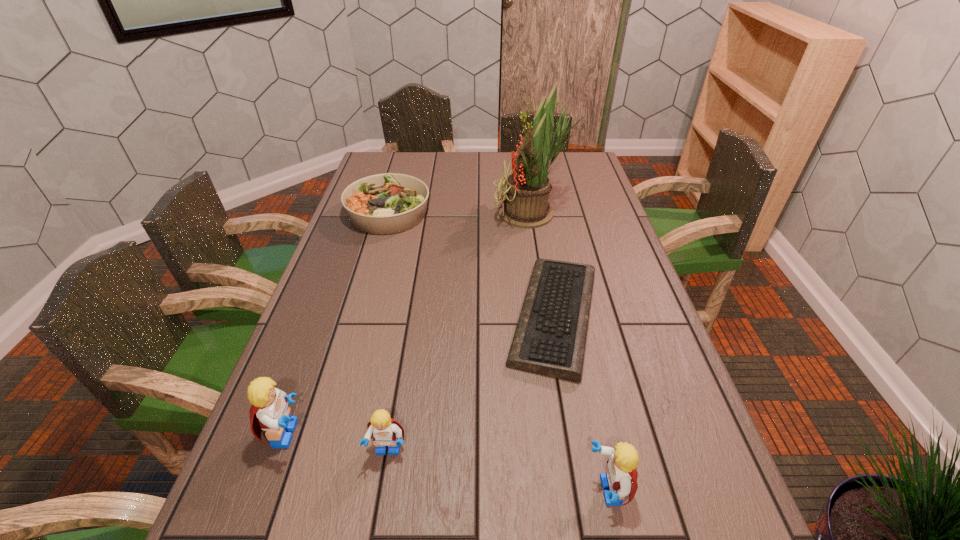
Locate an element on the screen. free region located 0.070m on the front-facing side of the rightmost Lego is located at coordinates (549, 490).

At what (x,y) coordinates should I click in order to perform the action: click on vacant area located on the front-facing side of the rightmost Lego. Please return your answer as a coordinate pair (x, y). Looking at the image, I should click on (474, 490).

I want to click on free space located 0.090m on the front-facing side of the rightmost Lego, so click(x=539, y=490).

Locate an element on the screen. This screenshot has height=540, width=960. free spot located in front of the tallest object with the fan visible is located at coordinates tap(396, 213).

The height and width of the screenshot is (540, 960). Identify the location of vacant area situated in front of the tallest object with the fan visible. (444, 213).

At what (x,y) coordinates should I click in order to perform the action: click on vacant point located 0.240m in front of the tallest object with the fan visible. Please return your answer as a coordinate pair (x, y). This screenshot has width=960, height=540. Looking at the image, I should click on (424, 213).

The width and height of the screenshot is (960, 540). What are the coordinates of `vacant point located on the left of the shortest object` in the screenshot? It's located at (355, 316).

I want to click on free space located on the back of the salad plate, so click(405, 154).

Locate an element on the screen. The width and height of the screenshot is (960, 540). Lego situated at the left edge is located at coordinates (270, 412).

Where is `salad plate present at the left edge`? salad plate present at the left edge is located at coordinates (389, 203).